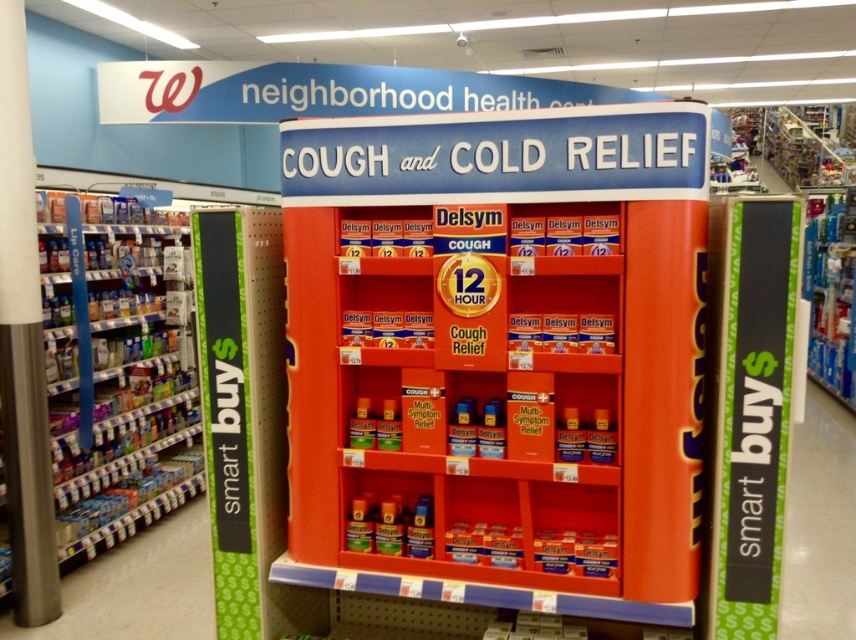
Which is below, green matte signboard at right or green matte signboard at left?

green matte signboard at left

Does green matte signboard at right appear on the left side of green matte signboard at left?

No, green matte signboard at right is not to the left of green matte signboard at left.

The width and height of the screenshot is (856, 640). What do you see at coordinates (749, 406) in the screenshot?
I see `green matte signboard at right` at bounding box center [749, 406].

The width and height of the screenshot is (856, 640). I want to click on green matte signboard at right, so click(749, 406).

Is matte plastic shelves at left below green matte signboard at left?

Indeed, matte plastic shelves at left is positioned under green matte signboard at left.

Does point (180, 225) lie behind point (232, 337)?

Yes, it is behind point (232, 337).

Identify the location of matte plastic shelves at left. The width and height of the screenshot is (856, 640). (x=117, y=371).

Who is positioned more to the right, matte plastic shelves at left or green matte signboard at right?

green matte signboard at right is more to the right.

Which is in front, point (126, 520) or point (758, 536)?

Positioned in front is point (758, 536).

You are a GUI agent. You are given a task and a screenshot of the screen. Output one action in this format:
    pyautogui.click(x=<x>, y=<y>)
    Task: Click on the matte plastic shelves at left
    The image size is (856, 640).
    Given the screenshot: What is the action you would take?
    pyautogui.click(x=117, y=371)